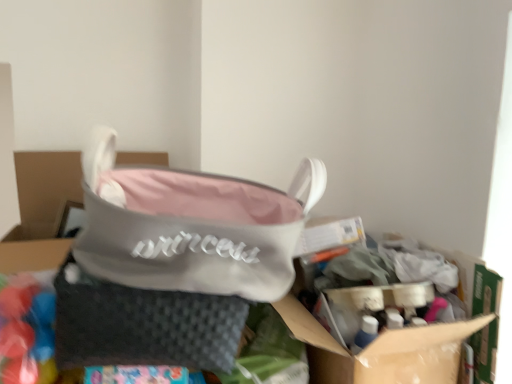
Question: Considering the positions of cardboard box at center and gray woven pouch at center in the image, is cardboard box at center taller or shorter than gray woven pouch at center?

Choices:
 (A) short
 (B) tall

Answer: (B)

Question: Is point (453, 329) positioned closer to the camera than point (135, 324)?

Choices:
 (A) farther
 (B) closer

Answer: (A)

Question: Which is farther from the pink fabric handbag at center?

Choices:
 (A) cardboard box at center
 (B) gray woven pouch at center

Answer: (A)

Question: Estimate the real-world distances between objects in this image. Which object is closer to the gray woven pouch at center?

Choices:
 (A) pink fabric handbag at center
 (B) cardboard box at center

Answer: (A)